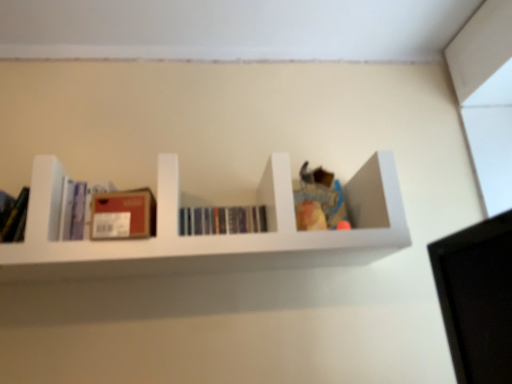
Question: Is white matte shelf at center smaller than matte cardboard box at center left?

Choices:
 (A) no
 (B) yes

Answer: (A)

Question: Considering the relative positions of white matte shelf at center and matte cardboard box at center left in the image provided, is white matte shelf at center in front of matte cardboard box at center left?

Choices:
 (A) yes
 (B) no

Answer: (A)

Question: Is white matte shelf at center to the left of matte cardboard box at center left from the viewer's perspective?

Choices:
 (A) yes
 (B) no

Answer: (B)

Question: Is white matte shelf at center looking in the opposite direction of matte cardboard box at center left?

Choices:
 (A) no
 (B) yes

Answer: (B)

Question: Does white matte shelf at center have a lesser height compared to matte cardboard box at center left?

Choices:
 (A) yes
 (B) no

Answer: (B)

Question: Is white matte shelf at center at the right side of matte cardboard box at center left?

Choices:
 (A) no
 (B) yes

Answer: (B)

Question: From a real-world perspective, is matte cardboard box at center left located higher than white matte shelf at center?

Choices:
 (A) yes
 (B) no

Answer: (B)

Question: Considering the relative sizes of matte cardboard box at center left and white matte shelf at center in the image provided, is matte cardboard box at center left shorter than white matte shelf at center?

Choices:
 (A) yes
 (B) no

Answer: (A)

Question: Is matte cardboard box at center left oriented away from white matte shelf at center?

Choices:
 (A) no
 (B) yes

Answer: (B)

Question: Can you confirm if matte cardboard box at center left is smaller than white matte shelf at center?

Choices:
 (A) yes
 (B) no

Answer: (A)

Question: From a real-world perspective, does matte cardboard box at center left sit lower than white matte shelf at center?

Choices:
 (A) yes
 (B) no

Answer: (A)

Question: From the image's perspective, is matte cardboard box at center left above white matte shelf at center?

Choices:
 (A) no
 (B) yes

Answer: (A)

Question: Can you confirm if matte purple book at left, which is the second book in right-to-left order, is shorter than hardcover books at center, the first book in the right-to-left sequence?

Choices:
 (A) yes
 (B) no

Answer: (B)